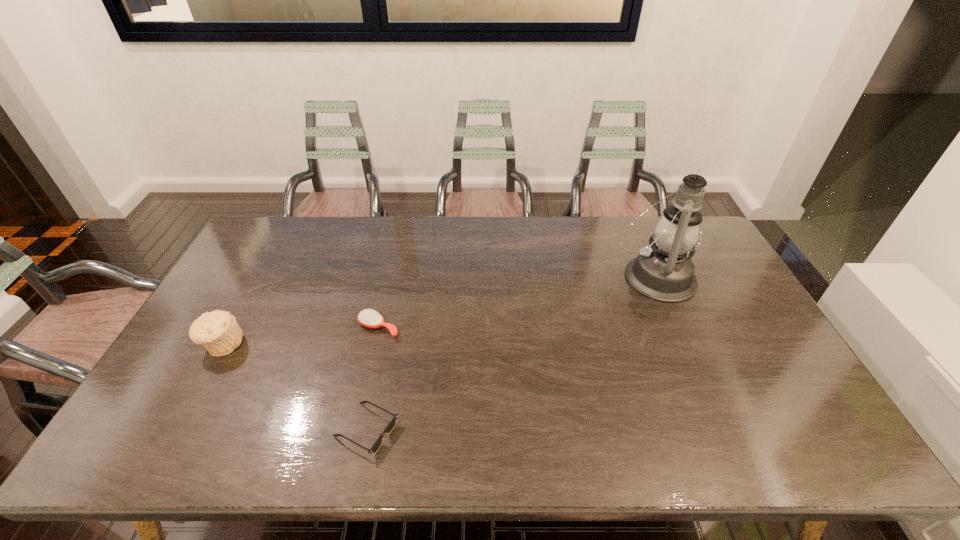
At what (x,y) coordinates should I click in order to perform the action: click on vacant space situated 0.110m on the lenses of the shortest object. Please return your answer as a coordinate pair (x, y). This screenshot has width=960, height=540. Looking at the image, I should click on (444, 430).

At what (x,y) coordinates should I click in order to perform the action: click on object situated at the far edge. Please return your answer as a coordinate pair (x, y). The height and width of the screenshot is (540, 960). Looking at the image, I should click on (664, 271).

Locate an element on the screen. The height and width of the screenshot is (540, 960). object at the near edge is located at coordinates (391, 425).

What are the coordinates of `object that is at the left edge` in the screenshot? It's located at (218, 331).

I want to click on object that is at the right edge, so click(664, 271).

You are a GUI agent. You are given a task and a screenshot of the screen. Output one action in this format:
    pyautogui.click(x=<x>, y=<y>)
    Task: Click on the object at the far right corner
    
    Given the screenshot: What is the action you would take?
    pyautogui.click(x=664, y=271)

This screenshot has width=960, height=540. Identify the location of vacant position at the far edge of the desktop. (379, 234).

You are a GUI agent. You are given a task and a screenshot of the screen. Output one action in this format:
    pyautogui.click(x=<x>, y=<y>)
    Task: Click on the free space at the near edge of the desktop
    The height and width of the screenshot is (540, 960).
    Given the screenshot: What is the action you would take?
    pyautogui.click(x=492, y=450)

At what (x,y) coordinates should I click in order to perform the action: click on vacant space at the left edge. Please return your answer as a coordinate pair (x, y). Looking at the image, I should click on (250, 332).

Locate an element on the screen. This screenshot has height=540, width=960. vacant space at the right edge of the desktop is located at coordinates (713, 327).